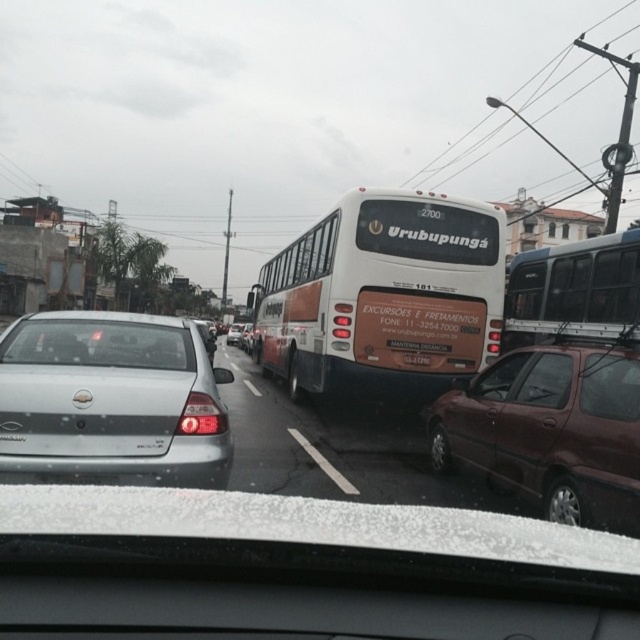
Question: Does maroon matte car at center have a larger size compared to clear glass windshield at center?

Choices:
 (A) yes
 (B) no

Answer: (A)

Question: Can you confirm if white matte bus at center is thinner than black plastic license plate at center?

Choices:
 (A) yes
 (B) no

Answer: (B)

Question: Does white matte van at right have a larger size compared to satin silver sedan at center?

Choices:
 (A) no
 (B) yes

Answer: (A)

Question: Which point appears closest to the camera in this image?

Choices:
 (A) (230, 333)
 (B) (637, 330)

Answer: (B)

Question: Which object is closer to the camera taking this photo?

Choices:
 (A) clear glass windshield at center
 (B) satin silver sedan at left

Answer: (B)

Question: Which object is farther from the camera taking this photo?

Choices:
 (A) satin silver sedan at left
 (B) maroon matte car at center
 (C) white matte bus at center
 (D) clear glass windshield at center

Answer: (C)